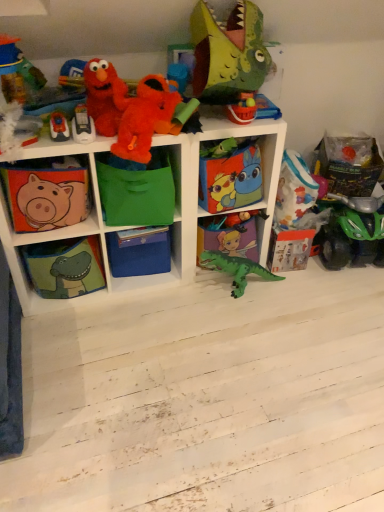
Question: Does green fabric bag at center, the 4th shelf when ordered from left to right, appear on the left side of green plastic dinosaur at center, which ranks as the 1th toy in bottom-to-top order?

Choices:
 (A) no
 (B) yes

Answer: (B)

Question: Is green fabric bag at center, which ranks as the 2th shelf in right-to-left order, not inside green plastic dinosaur at center, which ranks as the 1th toy in bottom-to-top order?

Choices:
 (A) yes
 (B) no

Answer: (A)

Question: Can you confirm if green fabric bag at center, the 4th shelf when ordered from left to right, is wider than green plastic dinosaur at center, placed as the seventh toy when sorted from top to bottom?

Choices:
 (A) no
 (B) yes

Answer: (B)

Question: Could you tell me if green fabric bag at center, the 4th shelf when ordered from left to right, is facing green plastic dinosaur at center, placed as the seventh toy when sorted from top to bottom?

Choices:
 (A) no
 (B) yes

Answer: (A)

Question: Is the depth of green fabric bag at center, the 4th shelf when ordered from left to right, less than that of green plastic dinosaur at center, placed as the seventh toy when sorted from top to bottom?

Choices:
 (A) no
 (B) yes

Answer: (B)

Question: Would you say green plastic dinosaur at center, placed as the seventh toy when sorted from top to bottom, is part of green fabric bag at center, which ranks as the 2th shelf in right-to-left order,'s contents?

Choices:
 (A) yes
 (B) no

Answer: (B)

Question: Considering the relative sizes of matte fabric piggy bank at left, which ranks as the first shelf in left-to-right order, and blue cardboard box at center, arranged as the 2th box when viewed from the top, in the image provided, is matte fabric piggy bank at left, which ranks as the first shelf in left-to-right order, shorter than blue cardboard box at center, arranged as the 2th box when viewed from the top,?

Choices:
 (A) no
 (B) yes

Answer: (A)

Question: Is matte fabric piggy bank at left, the fifth shelf viewed from the right, bigger than blue cardboard box at center, which appears as the 1th box when ordered from the bottom?

Choices:
 (A) yes
 (B) no

Answer: (B)

Question: Is matte fabric piggy bank at left, which ranks as the first shelf in left-to-right order, wider than blue cardboard box at center, the second box positioned from the right?

Choices:
 (A) yes
 (B) no

Answer: (B)

Question: From a real-world perspective, is matte fabric piggy bank at left, the fifth shelf viewed from the right, on blue cardboard box at center, the first box viewed from the left?

Choices:
 (A) no
 (B) yes

Answer: (B)

Question: From the image's perspective, is matte fabric piggy bank at left, the fifth shelf viewed from the right, on top of blue cardboard box at center, arranged as the 2th box when viewed from the top?

Choices:
 (A) no
 (B) yes

Answer: (B)

Question: Is matte fabric piggy bank at left, the fifth shelf viewed from the right, outside of blue cardboard box at center, the second box positioned from the right?

Choices:
 (A) no
 (B) yes

Answer: (B)

Question: Does matte plastic bucket at upper center, positioned as the 4th toy in bottom-to-top order, have a greater width compared to fluffy plush at upper left, the 3th toy when ordered from top to bottom?

Choices:
 (A) yes
 (B) no

Answer: (B)